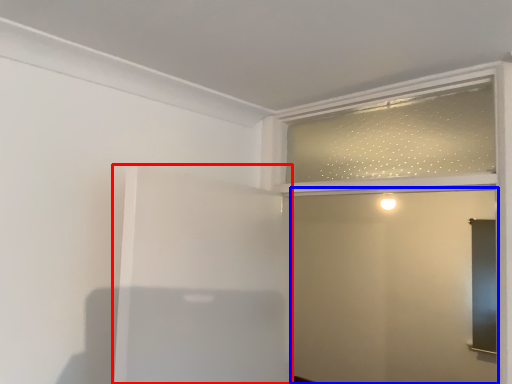
Question: Which of the following is the closest to the observer, elevator (highlighted by a red box) or screen door (highlighted by a blue box)?

Choices:
 (A) elevator
 (B) screen door

Answer: (A)